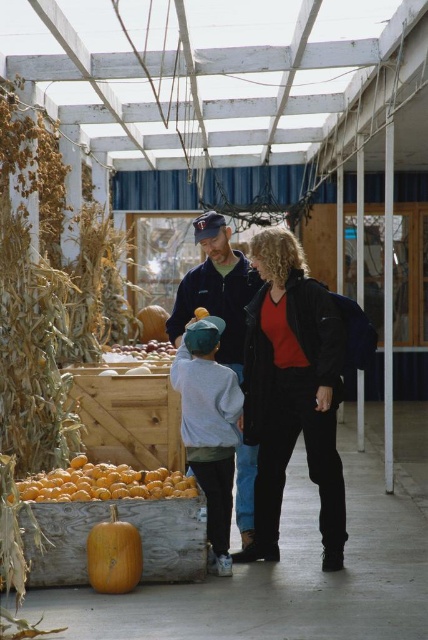
Question: Does black matte jacket at center have a smaller size compared to light gray sweatshirt at center?

Choices:
 (A) yes
 (B) no

Answer: (B)

Question: Among these objects, which one is nearest to the camera?

Choices:
 (A) orange matte pumpkin at lower left
 (B) smooth orange pumpkin at center
 (C) light gray sweatshirt at center

Answer: (A)

Question: Where is black matte jacket at center located in relation to light gray sweatshirt at center in the image?

Choices:
 (A) right
 (B) left

Answer: (A)

Question: Does black matte jacket at center have a smaller size compared to wooden crate at center?

Choices:
 (A) no
 (B) yes

Answer: (A)

Question: Which point is closer to the camera?

Choices:
 (A) (133, 356)
 (B) (122, 540)
 (C) (152, 332)
 (D) (278, 529)

Answer: (B)

Question: Which object is the farthest from the orange matte pumpkin at lower left?

Choices:
 (A) black matte jacket at center
 (B) orange matte pumpkins at lower left
 (C) wooden crate at center

Answer: (C)